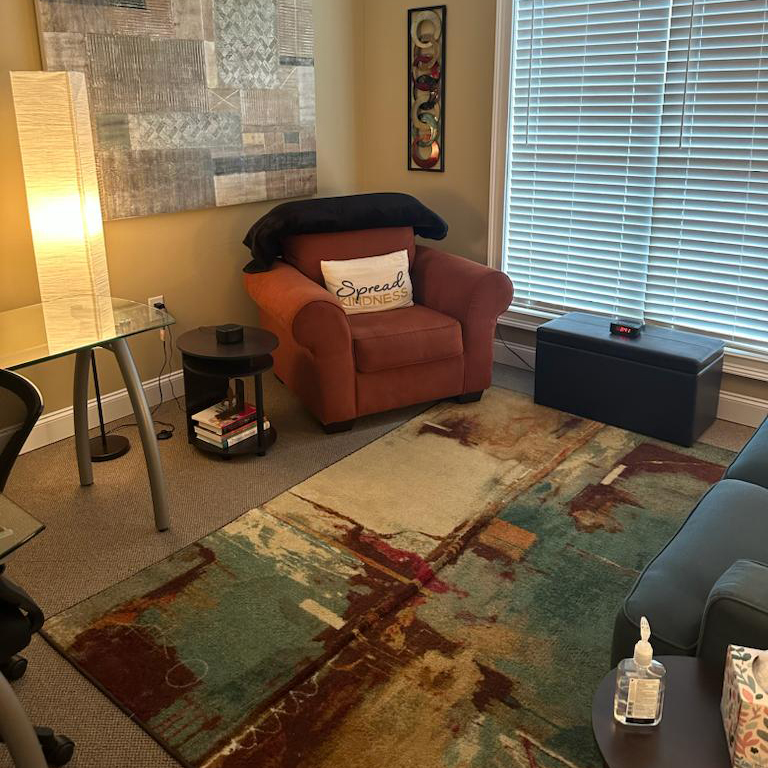
Image resolution: width=768 pixels, height=768 pixels. Find the location of `tissue box`. tissue box is located at coordinates (752, 720).